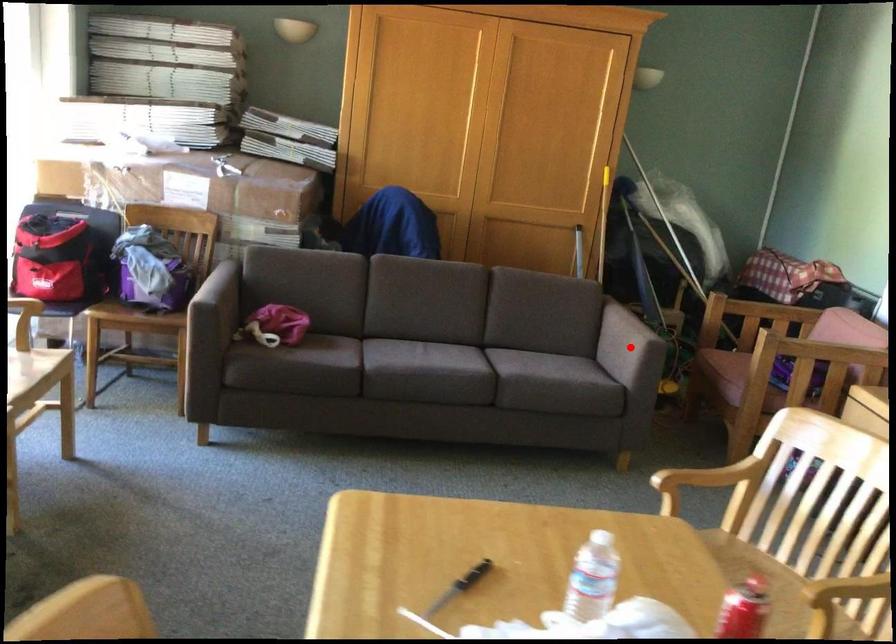
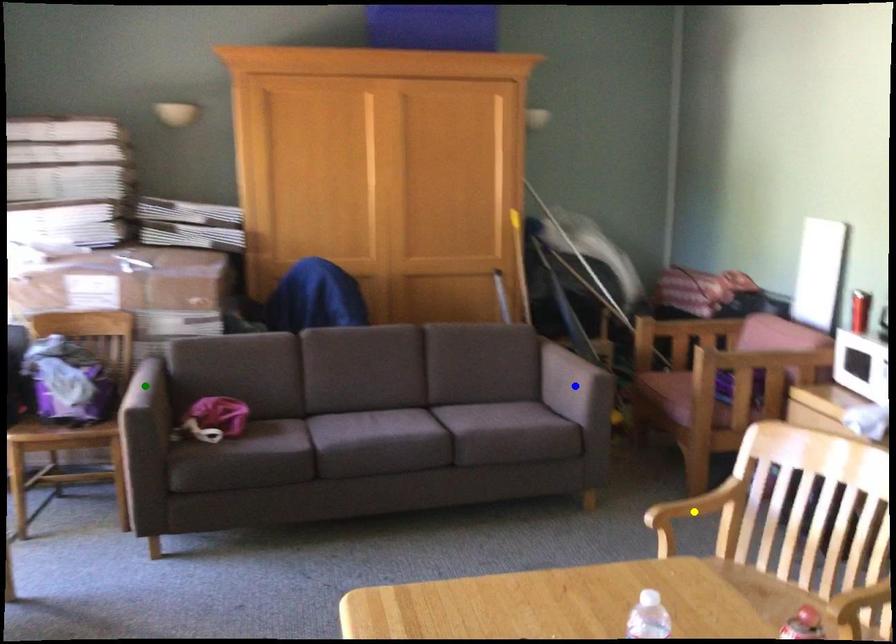
Question: I am providing you with two images of the same scene from different viewpoints. A red point is marked on the first image. You are given multiple points on the second image. Which point in image 2 represents the same 3d spot as the red point in image 1?

Choices:
 (A) green point
 (B) blue point
 (C) yellow point

Answer: (B)